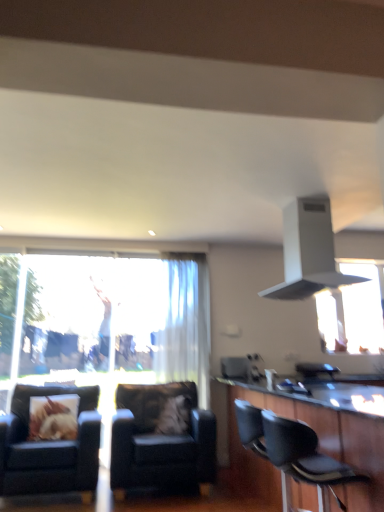
Question: Is leather armchair at center, which is the third chair from front to back, located outside fluffy fabric pillow at center, the second pillow from the left?

Choices:
 (A) no
 (B) yes

Answer: (B)

Question: Is leather armchair at center, the 1th chair from the back, facing towards fluffy fabric pillow at center, the 1th pillow positioned from the right?

Choices:
 (A) no
 (B) yes

Answer: (B)

Question: Is leather armchair at center, the second chair viewed from the left, to the left of fluffy fabric pillow at center, the second pillow from the left, from the viewer's perspective?

Choices:
 (A) no
 (B) yes

Answer: (B)

Question: Is leather armchair at center, the second chair viewed from the left, wider than fluffy fabric pillow at center, the 1th pillow positioned from the right?

Choices:
 (A) no
 (B) yes

Answer: (B)

Question: Is leather armchair at center, the second chair viewed from the left, thinner than fluffy fabric pillow at center, the 1th pillow positioned from the right?

Choices:
 (A) yes
 (B) no

Answer: (B)

Question: Does leather armchair at center, marked as the second chair in a right-to-left arrangement, have a smaller size compared to fluffy fabric pillow at center, the 1th pillow positioned from the right?

Choices:
 (A) no
 (B) yes

Answer: (A)

Question: Is white matte exhaust hood at upper center surrounding black leather chair at lower right, which is the first chair in right-to-left order?

Choices:
 (A) yes
 (B) no

Answer: (B)

Question: Is the position of white matte exhaust hood at upper center more distant than that of black leather chair at lower right, arranged as the 3th chair when viewed from the back?

Choices:
 (A) no
 (B) yes

Answer: (B)

Question: Does white matte exhaust hood at upper center have a greater width compared to black leather chair at lower right, arranged as the 3th chair when viewed from the back?

Choices:
 (A) yes
 (B) no

Answer: (A)

Question: Is the position of white matte exhaust hood at upper center less distant than that of black leather chair at lower right, which is the first chair in right-to-left order?

Choices:
 (A) no
 (B) yes

Answer: (A)

Question: Is white matte exhaust hood at upper center taller than black leather chair at lower right, arranged as the 3th chair when viewed from the back?

Choices:
 (A) yes
 (B) no

Answer: (A)

Question: From a real-world perspective, is white matte exhaust hood at upper center located beneath black leather chair at lower right, which is the first chair in right-to-left order?

Choices:
 (A) yes
 (B) no

Answer: (B)

Question: Does leather armchair at center, the second chair viewed from the left, have a larger size compared to black leather chair at lower right, which appears as the 3th chair when viewed from the left?

Choices:
 (A) yes
 (B) no

Answer: (A)